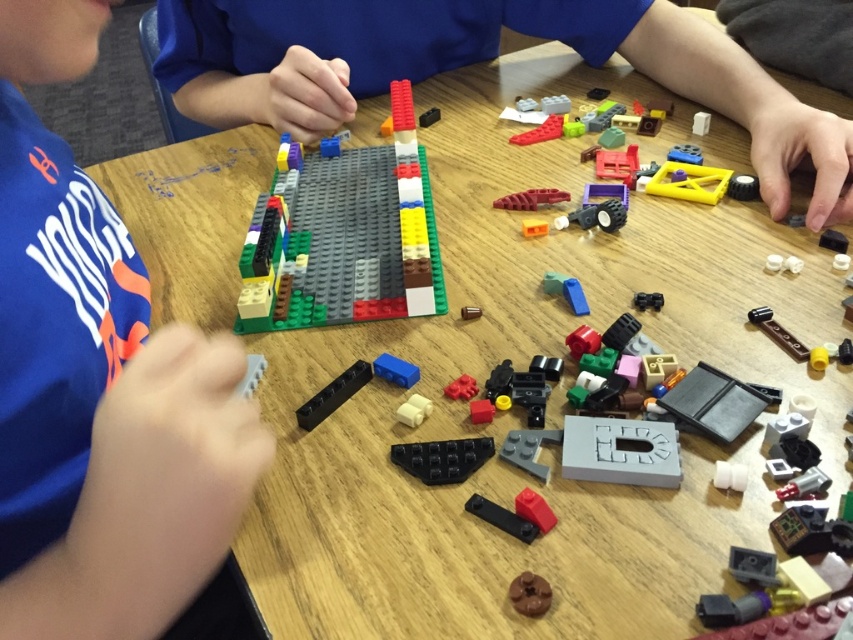
Question: Which point is closer to the camera?

Choices:
 (A) (445, 385)
 (B) (801, 344)

Answer: (B)

Question: Is translucent gray plastic at center wider than rubberized red brick at center?

Choices:
 (A) yes
 (B) no

Answer: (A)

Question: Can you confirm if multicolored plastic building blocks at center is positioned below matte red plastic car at center?

Choices:
 (A) no
 (B) yes

Answer: (A)

Question: From the image, what is the correct spatial relationship of blue matte shirt at upper left in relation to white matte brick at center?

Choices:
 (A) left
 (B) right

Answer: (A)

Question: Which point appears closest to the camera in this image?

Choices:
 (A) (618, 387)
 (B) (318, 392)

Answer: (A)

Question: Which is nearer to the matte blue plastic brick at center?

Choices:
 (A) matte red plastic car at center
 (B) brown matte gear at lower center

Answer: (B)